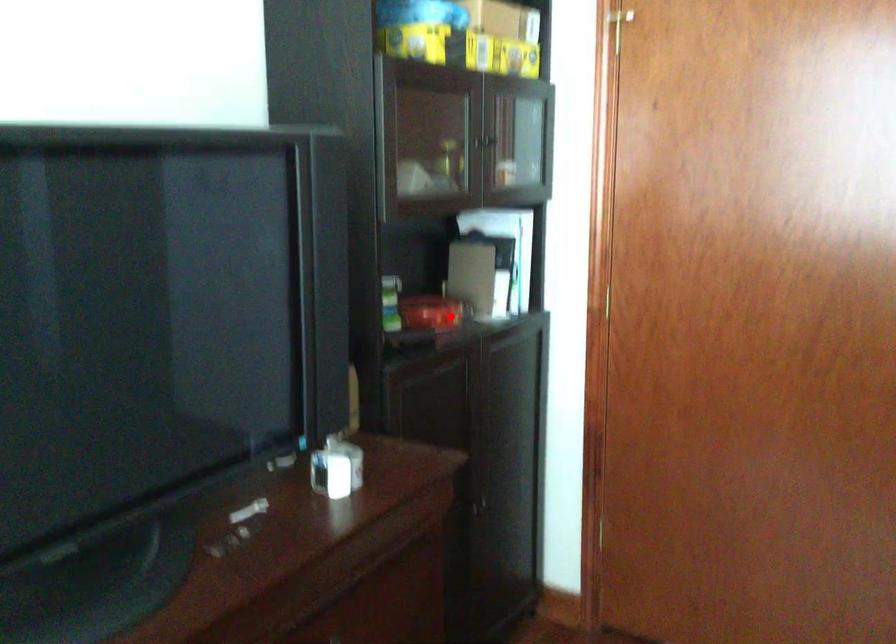
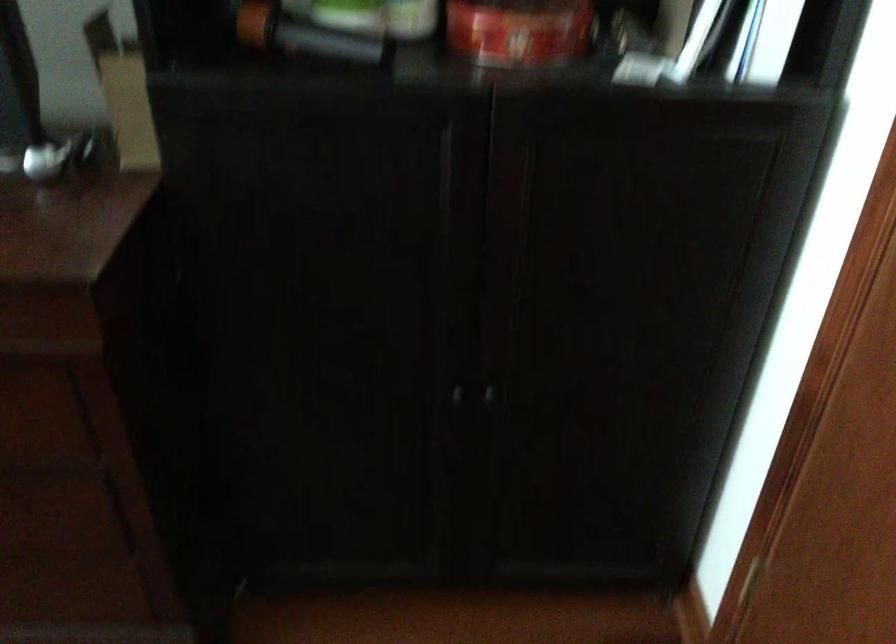
Question: I am providing you with two images of the same scene from different viewpoints. In image1, a red point is highlighted. Considering the same 3D point in image2, which of the following is correct?

Choices:
 (A) It is closer
 (B) It is farther

Answer: (A)